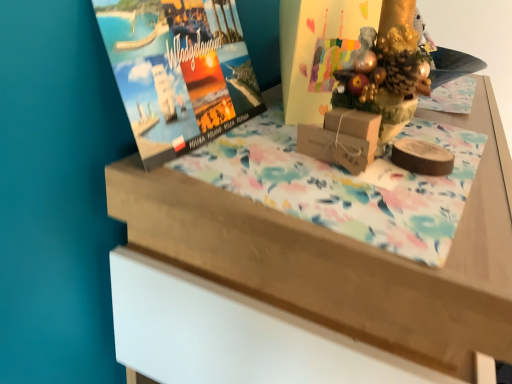
Question: From the image's perspective, is brown cardboard box at center beneath matte paper magazine at upper left?

Choices:
 (A) no
 (B) yes

Answer: (B)

Question: Is brown cardboard box at center with matte paper magazine at upper left?

Choices:
 (A) yes
 (B) no

Answer: (B)

Question: Could you tell me if brown cardboard box at center is turned towards matte paper magazine at upper left?

Choices:
 (A) no
 (B) yes

Answer: (A)

Question: From the image's perspective, does brown cardboard box at center appear higher than matte paper magazine at upper left?

Choices:
 (A) no
 (B) yes

Answer: (A)

Question: Is the depth of brown cardboard box at center greater than that of matte paper magazine at upper left?

Choices:
 (A) yes
 (B) no

Answer: (A)

Question: Is brown cardboard box at center taller or shorter than matte paper magazine at upper left?

Choices:
 (A) tall
 (B) short

Answer: (B)

Question: From a real-world perspective, is brown cardboard box at center positioned above or below matte paper magazine at upper left?

Choices:
 (A) below
 (B) above

Answer: (A)

Question: From the image's perspective, is brown cardboard box at center located above or below matte paper magazine at upper left?

Choices:
 (A) above
 (B) below

Answer: (B)

Question: In the image, is brown cardboard box at center positioned in front of or behind matte paper magazine at upper left?

Choices:
 (A) front
 (B) behind

Answer: (B)

Question: In the image, is wooden table at upper center on the left side or the right side of matte paper magazine at upper left?

Choices:
 (A) left
 (B) right

Answer: (B)

Question: Choose the correct answer: Is wooden table at upper center inside matte paper magazine at upper left or outside it?

Choices:
 (A) outside
 (B) inside

Answer: (A)

Question: Based on their sizes in the image, would you say wooden table at upper center is bigger or smaller than matte paper magazine at upper left?

Choices:
 (A) big
 (B) small

Answer: (A)

Question: Is point (178, 230) closer or farther from the camera than point (139, 134)?

Choices:
 (A) farther
 (B) closer

Answer: (B)

Question: Looking at their shapes, would you say wooden table at upper center is wider or thinner than matte cardboard book cover at center?

Choices:
 (A) wide
 (B) thin

Answer: (A)

Question: Is wooden table at upper center in front of or behind matte cardboard book cover at center in the image?

Choices:
 (A) behind
 (B) front

Answer: (B)